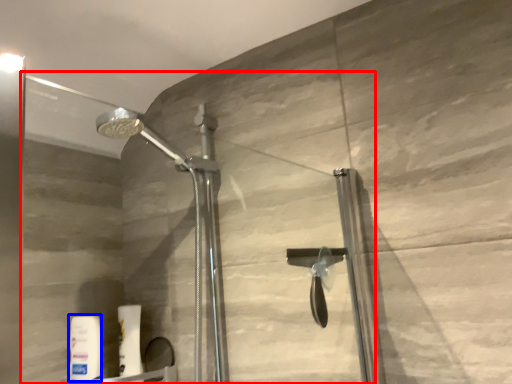
Question: Among these objects, which one is nearest to the camera, glass door (highlighted by a red box) or toiletry (highlighted by a blue box)?

Choices:
 (A) glass door
 (B) toiletry

Answer: (A)